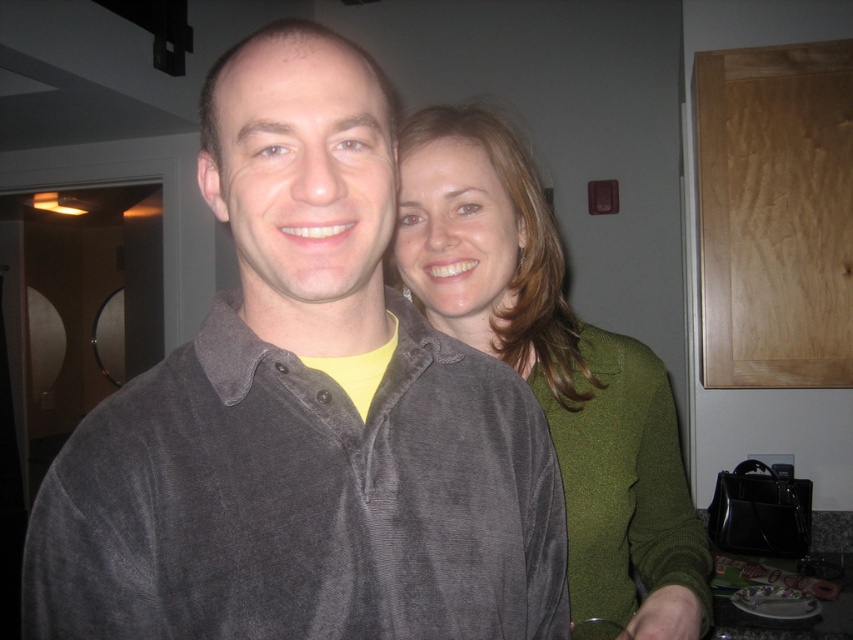
Question: Which of the following is the farthest from the observer?

Choices:
 (A) tap(692, 573)
 (B) tap(177, 404)

Answer: (A)

Question: Can you confirm if velvet gray shirt at center is positioned to the right of green velvety sweater at center?

Choices:
 (A) yes
 (B) no

Answer: (B)

Question: Which point is farther to the camera?

Choices:
 (A) pos(242,609)
 (B) pos(552,346)

Answer: (B)

Question: Among these objects, which one is nearest to the camera?

Choices:
 (A) green velvety sweater at center
 (B) velvet gray shirt at center

Answer: (B)

Question: Does velvet gray shirt at center have a larger size compared to green velvety sweater at center?

Choices:
 (A) yes
 (B) no

Answer: (B)

Question: Can you confirm if velvet gray shirt at center is thinner than green velvety sweater at center?

Choices:
 (A) yes
 (B) no

Answer: (A)